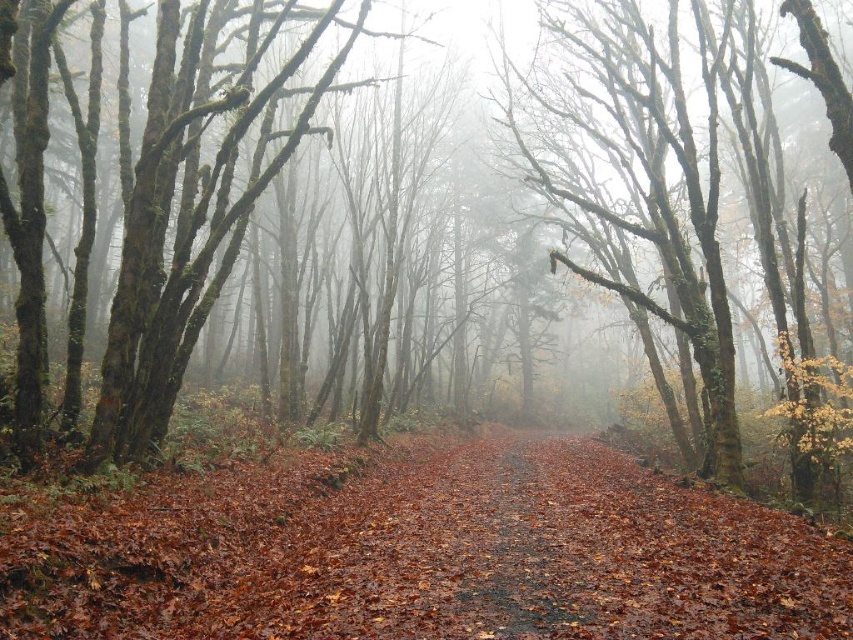
You are a hiker who wants to take a photo of the smooth bark tree at center and the brown leafy forest path at center. Since you want both to be clearly visible in the photo, which one should you zoom in on more?

The smooth bark tree at center is larger in size than the brown leafy forest path at center, so you should zoom in more on the brown leafy forest path at center to ensure both are clearly visible in the photo.

You are a hiker walking along the brown leafy forest path at center in the misty forest. You want to reach the smooth bark tree at center. Which direction should you move to get closer to the tree?

The smooth bark tree at center is located above the brown leafy forest path at center, so you should move forward along the path towards the direction where the tree appears higher in the scene to get closer to it.